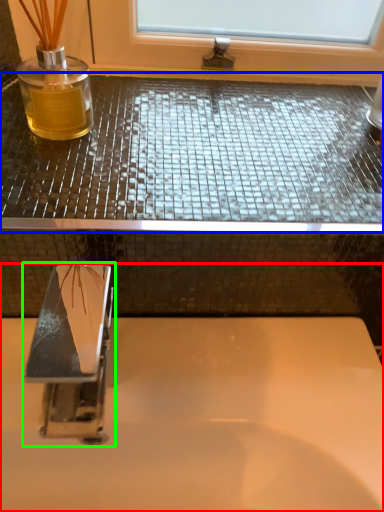
Question: Based on their relative distances, which object is farther from sink (highlighted by a red box)? Choose from counter top (highlighted by a blue box) and tap (highlighted by a green box).

Choices:
 (A) counter top
 (B) tap

Answer: (A)